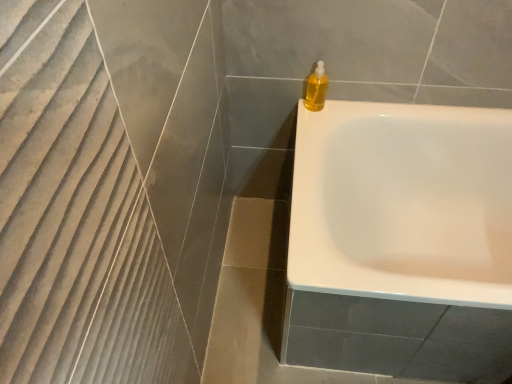
Question: Is point (311, 82) closer or farther from the camera than point (362, 192)?

Choices:
 (A) farther
 (B) closer

Answer: (B)

Question: From their relative heights in the image, would you say translucent yellow liquid at upper right is taller or shorter than white glossy bathtub at upper right?

Choices:
 (A) tall
 (B) short

Answer: (B)

Question: Would you say translucent yellow liquid at upper right is to the left or to the right of white glossy bathtub at upper right in the picture?

Choices:
 (A) left
 (B) right

Answer: (A)

Question: Does point (300, 241) appear closer or farther from the camera than point (317, 61)?

Choices:
 (A) closer
 (B) farther

Answer: (A)

Question: Choose the correct answer: Is white glossy bathtub at upper right inside translucent yellow liquid at upper right or outside it?

Choices:
 (A) outside
 (B) inside

Answer: (A)

Question: Looking at the image, does white glossy bathtub at upper right seem bigger or smaller compared to translucent yellow liquid at upper right?

Choices:
 (A) small
 (B) big

Answer: (B)

Question: Relative to translucent yellow liquid at upper right, is white glossy bathtub at upper right in front or behind?

Choices:
 (A) behind
 (B) front

Answer: (B)